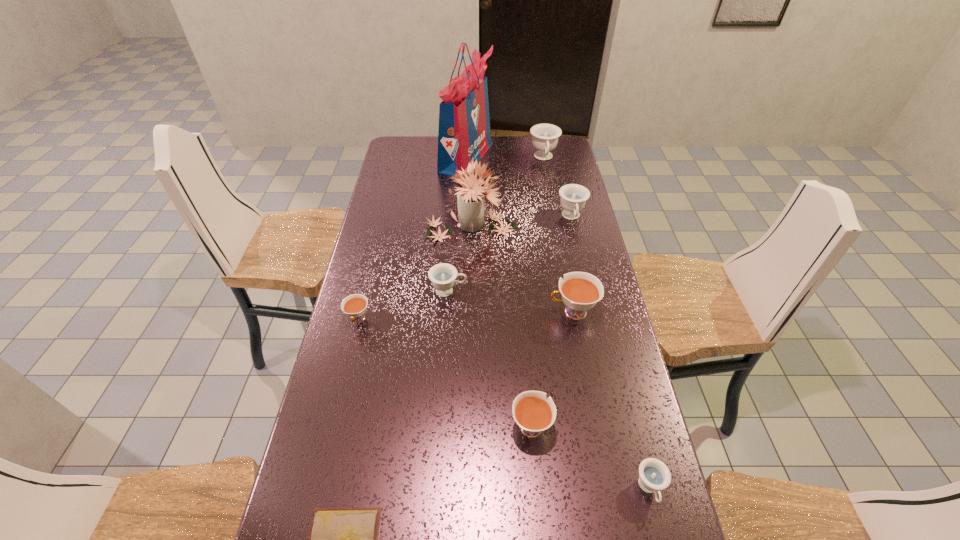
Find the location of `white teacup that is the second closest one to the sixth teacup from right to left`. white teacup that is the second closest one to the sixth teacup from right to left is located at coordinates (580, 291).

Where is `free space in the image that satisfies the following two spatial constraints: 1. on the front-facing side of the white bouquet; 2. on the right side of the tallest object`? The width and height of the screenshot is (960, 540). free space in the image that satisfies the following two spatial constraints: 1. on the front-facing side of the white bouquet; 2. on the right side of the tallest object is located at coordinates (464, 226).

You are a GUI agent. You are given a task and a screenshot of the screen. Output one action in this format:
    pyautogui.click(x=<x>, y=<y>)
    Task: Click on the vacant area that satisfies the following two spatial constraints: 1. on the side of the biggest blue teacup with the handle; 2. on the side of the leftmost blue teacup with the handle
    Image resolution: width=960 pixels, height=540 pixels.
    Given the screenshot: What is the action you would take?
    pyautogui.click(x=568, y=291)

Where is `free point that satisfies the following two spatial constraints: 1. on the side of the rightmost white teacup with the handle; 2. on the side of the smallest white teacup with the handle`? Image resolution: width=960 pixels, height=540 pixels. free point that satisfies the following two spatial constraints: 1. on the side of the rightmost white teacup with the handle; 2. on the side of the smallest white teacup with the handle is located at coordinates (574, 319).